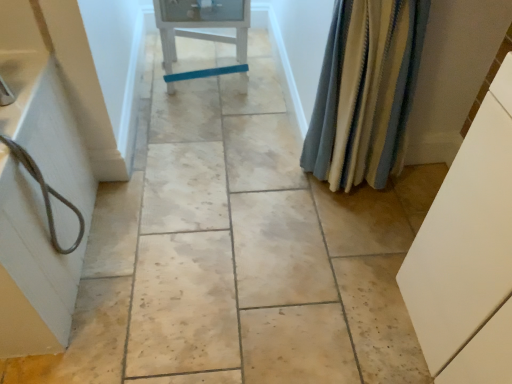
Question: Considering the positions of point (395, 168) and point (470, 357), is point (395, 168) closer or farther from the camera than point (470, 357)?

Choices:
 (A) farther
 (B) closer

Answer: (A)

Question: In terms of height, does striped fabric shower curtain at right look taller or shorter compared to white matte cabinet at right?

Choices:
 (A) short
 (B) tall

Answer: (A)

Question: Considering the real-world distances, which object is closest to the matte gray cord at left?

Choices:
 (A) white painted wood chair at center
 (B) striped fabric shower curtain at right
 (C) white matte cabinet at right

Answer: (B)

Question: Which of these objects is positioned farthest from the white matte cabinet at right?

Choices:
 (A) white painted wood chair at center
 (B) matte gray cord at left
 (C) striped fabric shower curtain at right

Answer: (A)